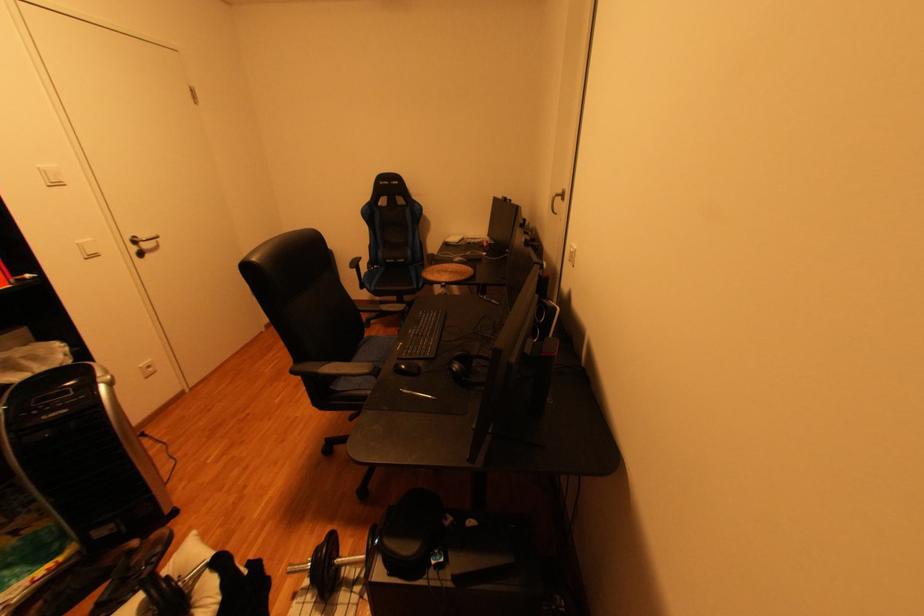
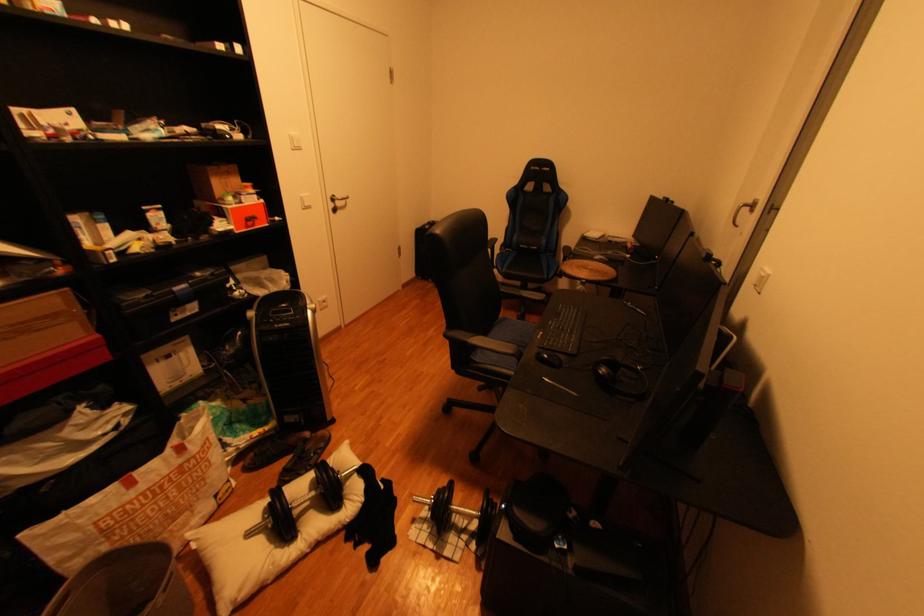
In the second image, find the point that corresponds to pixel 325 375 in the first image.

(477, 344)